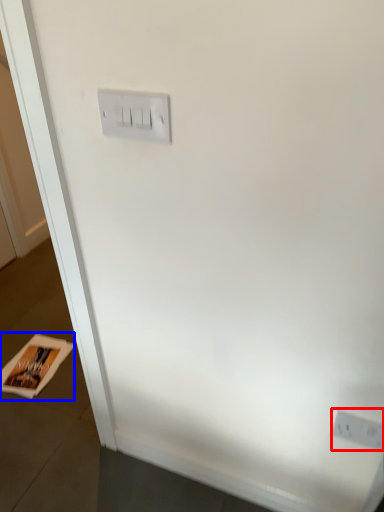
Question: Among these objects, which one is nearest to the camera, power plugs and sockets (highlighted by a red box) or magazine (highlighted by a blue box)?

Choices:
 (A) power plugs and sockets
 (B) magazine

Answer: (A)